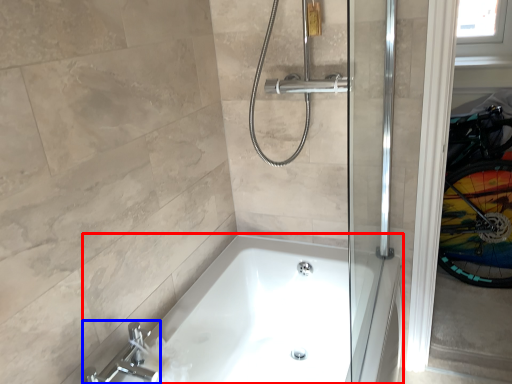
Question: Which point is closer to the camera, bathtub (highlighted by a red box) or tap (highlighted by a blue box)?

Choices:
 (A) bathtub
 (B) tap

Answer: (A)